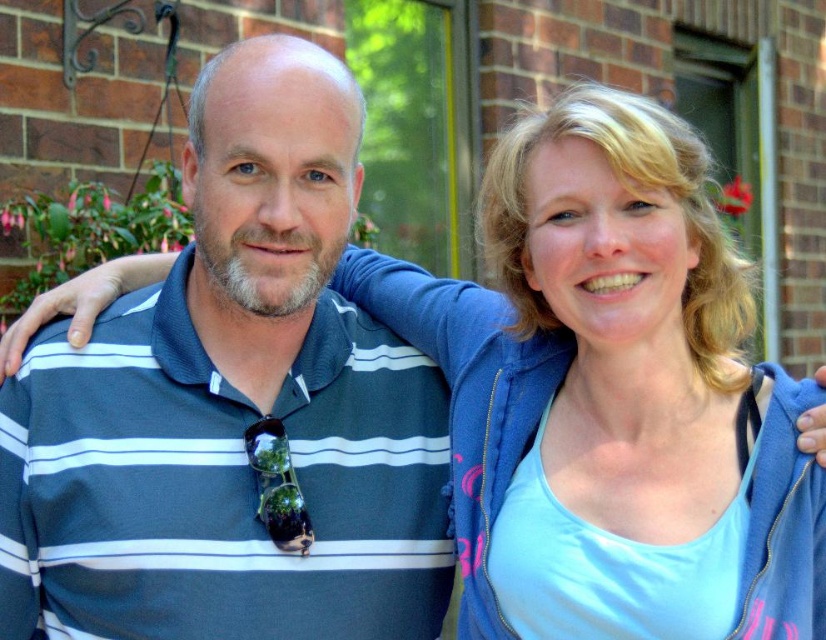
You are a photographer trying to capture both the dark blue striped polo shirt at left and the blue fleece jacket at upper right in a single frame. Which clothing item should you focus on first to ensure both fit in the shot?

The dark blue striped polo shirt at left is smaller than the blue fleece jacket at upper right, so focus on the larger blue fleece jacket at upper right first to ensure both fit in the shot.

You are standing at the point labeled point (x=22, y=460) and want to walk to the point labeled point (x=554, y=221). Given that both points are on the same path, which direction should you face to move towards your destination?

Since point (x=22, y=460) is behind point (x=554, y=221), you should face the direction opposite to where point (x=554, y=221) is located to move towards it.

You are a photographer setting up a photo shoot for a clothing catalog. You have two items to feature side by side in the shot. The first is the dark blue striped polo shirt at left, and the second is the blue fleece jacket at upper right. The catalog requires that the clothing items take up equal visual space in the photo. Given their current positions and sizes, which item might need adjustment to ensure both items appear the same size in the final image?

The dark blue striped polo shirt at left is wider than the blue fleece jacket at upper right. To make them appear the same size in the photo, the photographer should move the dark blue striped polo shirt at left farther away from the camera or the blue fleece jacket at upper right closer to the camera.